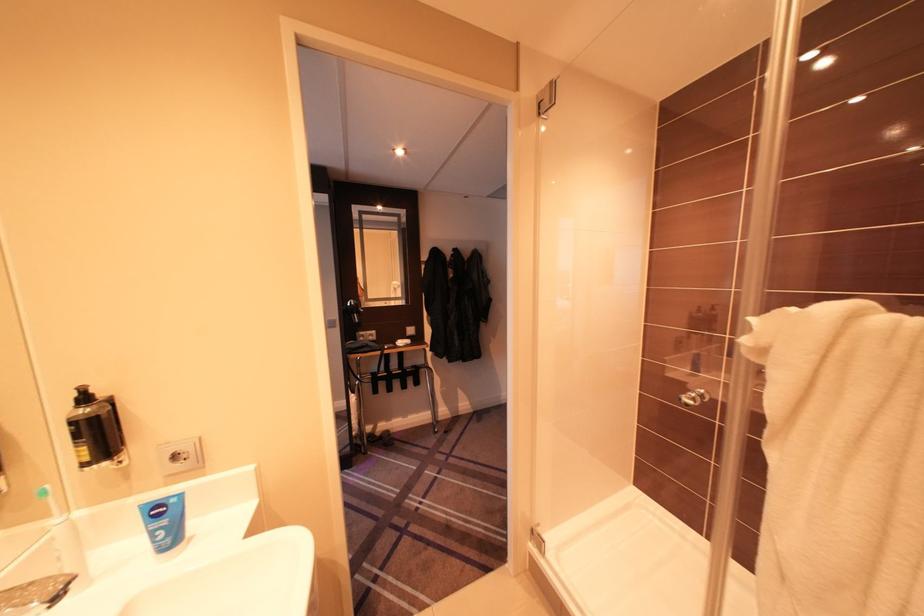
Locate an element on the screen. telephone handset is located at coordinates (361, 342).